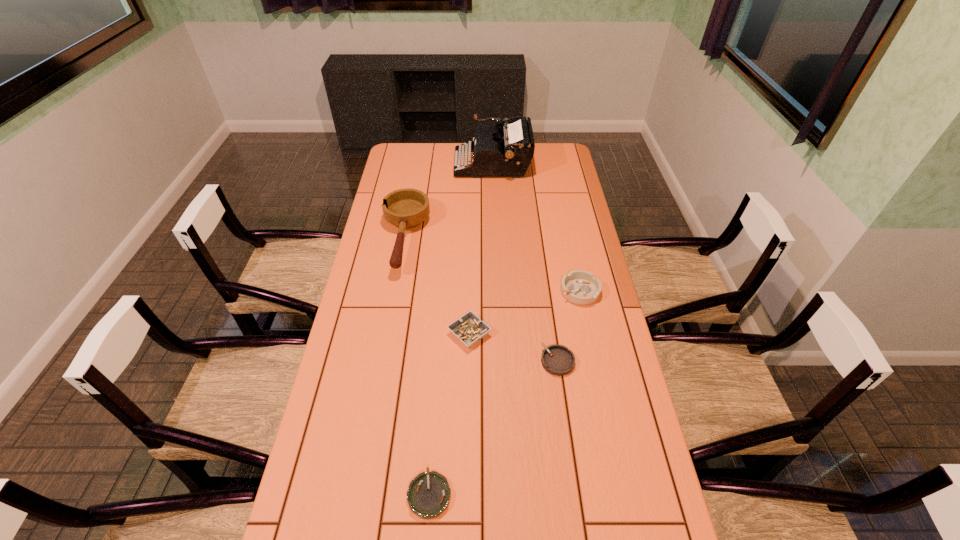
The width and height of the screenshot is (960, 540). Find the location of `empty space that is in between the tallest ashtray and the typewriter`. empty space that is in between the tallest ashtray and the typewriter is located at coordinates (537, 227).

What are the coordinates of `empty location between the farthest ashtray and the saucepan` in the screenshot? It's located at (492, 265).

Find the location of a particular element. The image size is (960, 540). vacant area between the saucepan and the farthest ashtray is located at coordinates (492, 265).

The width and height of the screenshot is (960, 540). What are the coordinates of `free spot between the leftmost object and the typewriter` in the screenshot? It's located at (448, 201).

Select which object is the fourth closest to the shortest ashtray. Please provide its 2D coordinates. Your answer should be formatted as a tuple, i.e. [(x, y)], where the tuple contains the x and y coordinates of a point satisfying the conditions above.

[(407, 208)]

I want to click on the fourth closest object relative to the leftmost object, so click(x=558, y=360).

The width and height of the screenshot is (960, 540). I want to click on ashtray that can be found as the closest to the typewriter, so click(x=580, y=287).

Locate an element on the screen. Image resolution: width=960 pixels, height=540 pixels. ashtray that stands as the third closest to the nearest object is located at coordinates (580, 287).

The width and height of the screenshot is (960, 540). I want to click on vacant position in the image that satisfies the following two spatial constraints: 1. on the back side of the tallest ashtray; 2. on the typing side of the farthest object, so click(x=553, y=164).

This screenshot has height=540, width=960. In order to click on free location that satisfies the following two spatial constraints: 1. with the handle on the side of the saucepan; 2. on the left side of the nearest object in this screenshot , I will do `click(358, 494)`.